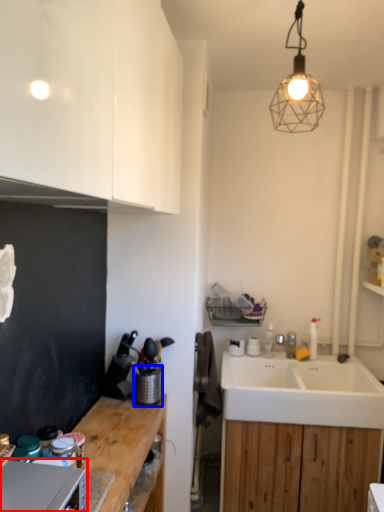
Question: Among these objects, which one is farthest to the camera, appliance (highlighted by a red box) or appliance (highlighted by a blue box)?

Choices:
 (A) appliance
 (B) appliance

Answer: (B)